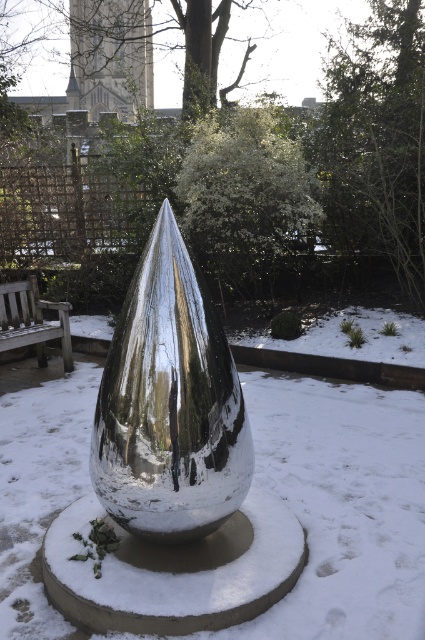
Question: Considering the relative positions of green leafy tree at upper center and wooden park bench at left in the image provided, where is green leafy tree at upper center located with respect to wooden park bench at left?

Choices:
 (A) left
 (B) right

Answer: (B)

Question: Which point is farther from the camera taking this photo?

Choices:
 (A) (221, 10)
 (B) (413, 298)
 (C) (155, 134)
 (D) (65, 358)

Answer: (A)

Question: Which object is the farthest from the shiny metallic teardrop at center?

Choices:
 (A) wooden park bench at left
 (B) green leafy tree at center
 (C) white textured bush at center

Answer: (C)

Question: Which object is the farthest from the white textured bush at center?

Choices:
 (A) shiny metallic teardrop at center
 (B) wooden park bench at left

Answer: (A)

Question: In this image, where is green leafy tree at upper right located relative to green leafy tree at upper center?

Choices:
 (A) below
 (B) above

Answer: (A)

Question: Is white textured bush at center to the left of wooden park bench at left from the viewer's perspective?

Choices:
 (A) no
 (B) yes

Answer: (A)